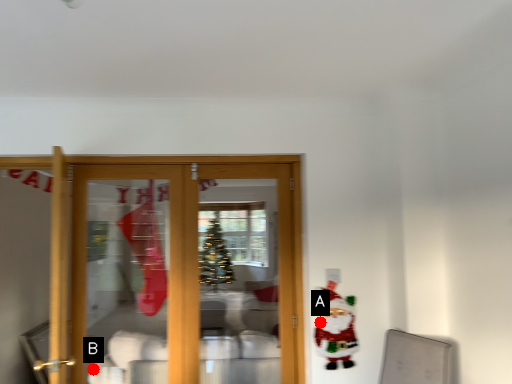
Question: Two points are circled on the image, labeled by A and B beside each circle. Which point appears closest to the camera in this image?

Choices:
 (A) A is closer
 (B) B is closer

Answer: (A)